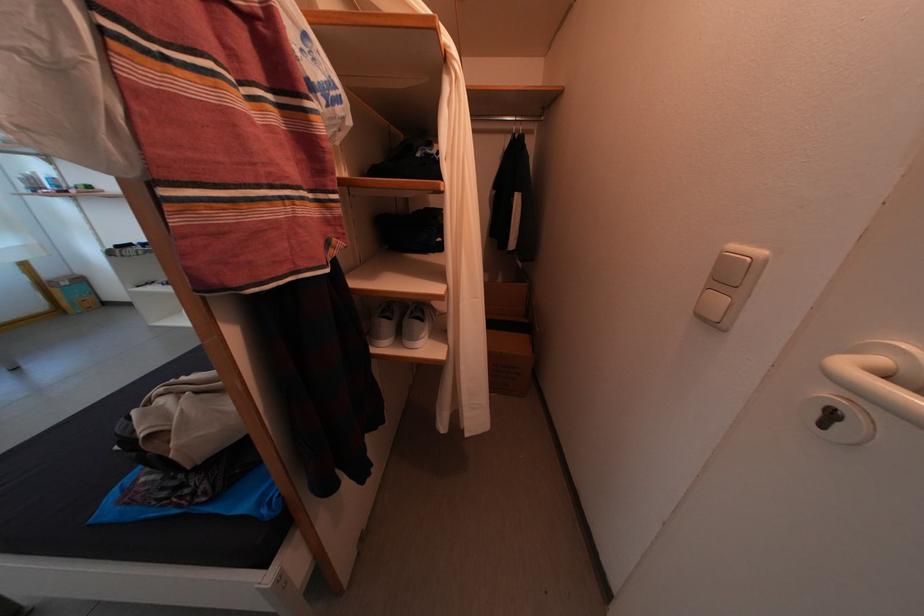
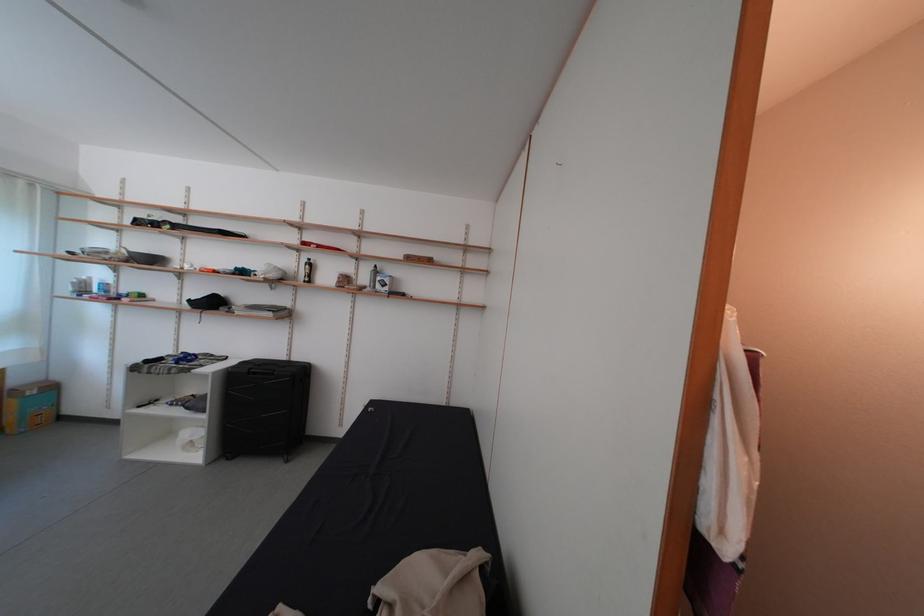
Question: Based on the continuous images, in which direction is the camera rotating? Reply with the corresponding letter.

Choices:
 (A) Left
 (B) Right
 (C) Up
 (D) Down

Answer: (C)